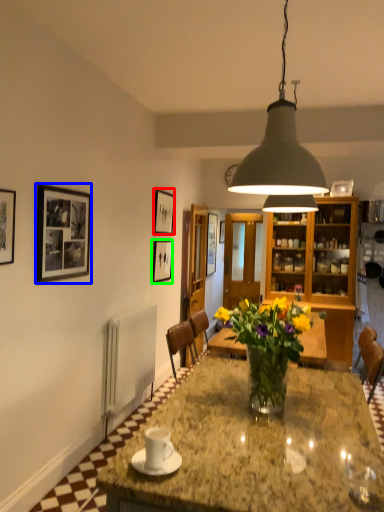
Question: Which object is positioned farthest from picture frame (highlighted by a red box)? Select from picture frame (highlighted by a blue box) and picture frame (highlighted by a green box).

Choices:
 (A) picture frame
 (B) picture frame

Answer: (A)